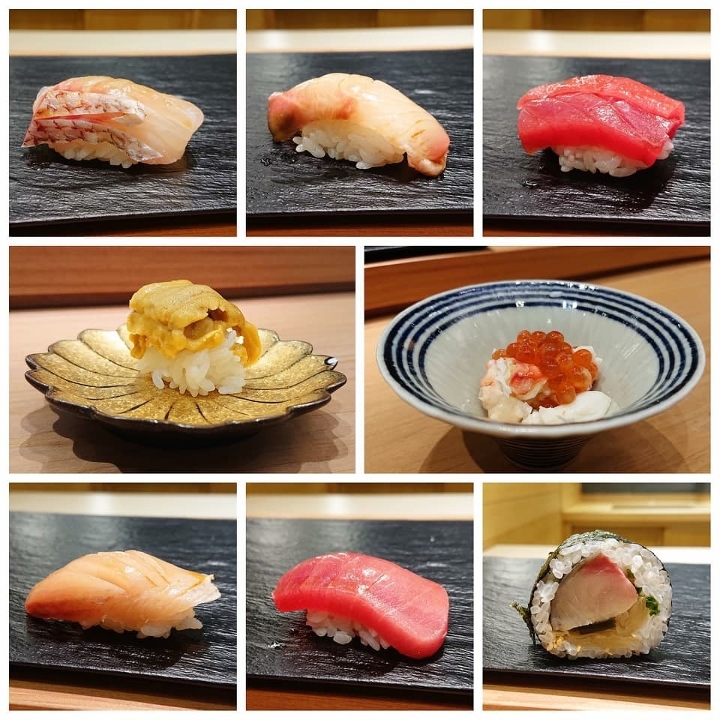
The height and width of the screenshot is (720, 720). Identify the location of bowl. (629, 343).